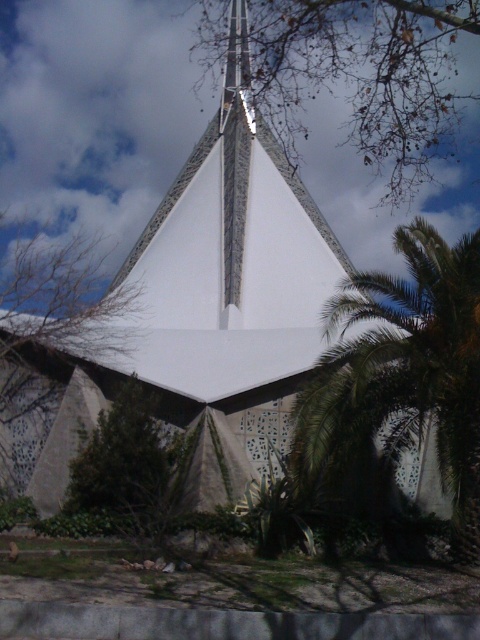
You are standing in front of the modern triangular building and notice two green leafy trees. Which one, the green leafy tree at center or the green leafy tree at lower left, is taller?

The green leafy tree at center is taller than the green leafy tree at lower left according to the description.